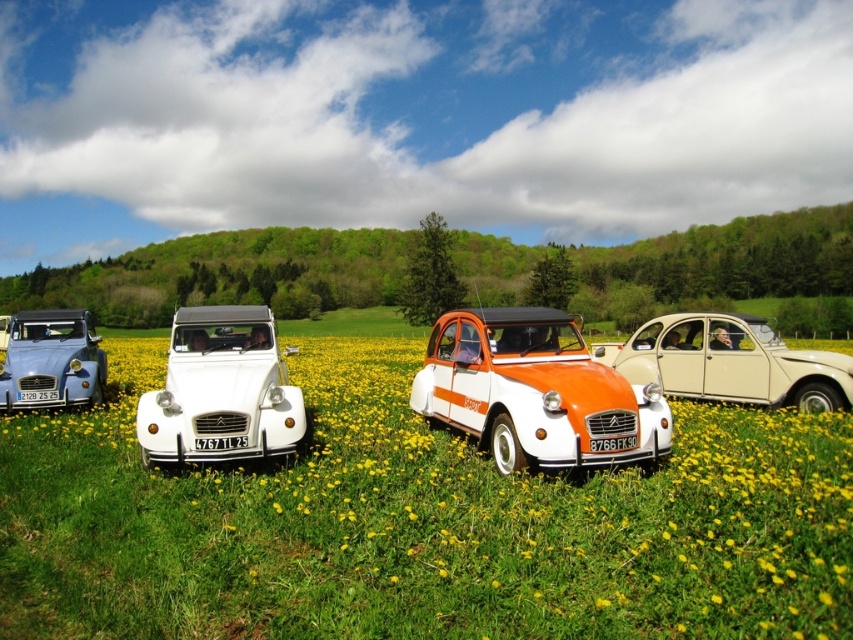
Can you confirm if white matte citroën 2cv at center is bigger than matte blue car at left?

Indeed, white matte citroën 2cv at center has a larger size compared to matte blue car at left.

Between white matte citroën 2cv at center and matte blue car at left, which one has more height?

white matte citroën 2cv at center is taller.

You are a GUI agent. You are given a task and a screenshot of the screen. Output one action in this format:
    pyautogui.click(x=<x>, y=<y>)
    Task: Click on the white matte citroën 2cv at center
    
    Given the screenshot: What is the action you would take?
    tap(221, 390)

Can you confirm if orange matte car at center is positioned to the right of beige matte car at center?

Incorrect, orange matte car at center is not on the right side of beige matte car at center.

Can you confirm if orange matte car at center is bigger than beige matte car at center?

Yes.

The image size is (853, 640). Describe the element at coordinates (535, 392) in the screenshot. I see `orange matte car at center` at that location.

The image size is (853, 640). I want to click on orange matte car at center, so click(x=535, y=392).

Identify the location of orange matte car at center. (535, 392).

Between point (483, 372) and point (57, 401), which one is positioned behind?

Positioned behind is point (57, 401).

Where is `orange matte car at center`? This screenshot has width=853, height=640. orange matte car at center is located at coordinates (535, 392).